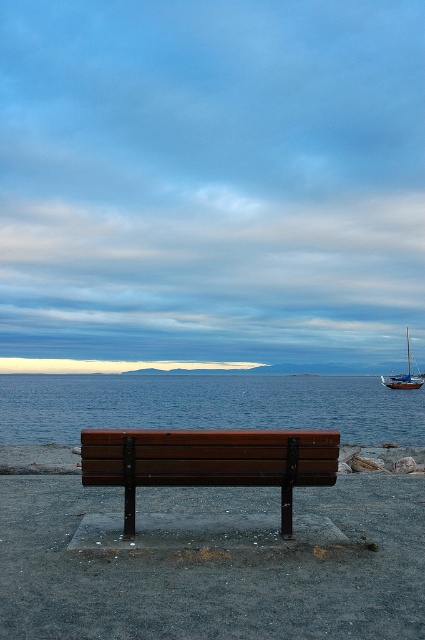
You are standing on the sandy shore and want to walk from the brown wood bench at lower center to the wooden sailboat at right. Which direction should you head towards?

Since the brown wood bench at lower center is closer to the viewer than the wooden sailboat at right, you should head towards the right direction to reach the wooden sailboat at right from the bench.